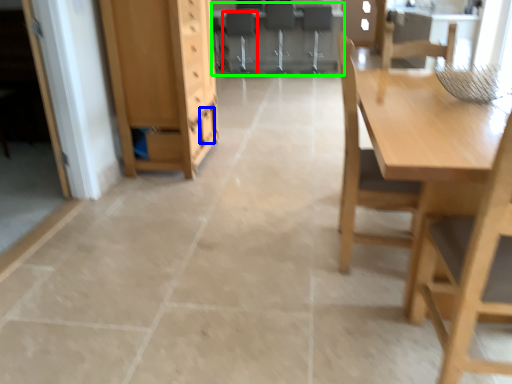
Question: Which is nearer to the chair (highlighted by a red box)? drawer (highlighted by a blue box) or computer desk (highlighted by a green box).

Choices:
 (A) drawer
 (B) computer desk

Answer: (B)